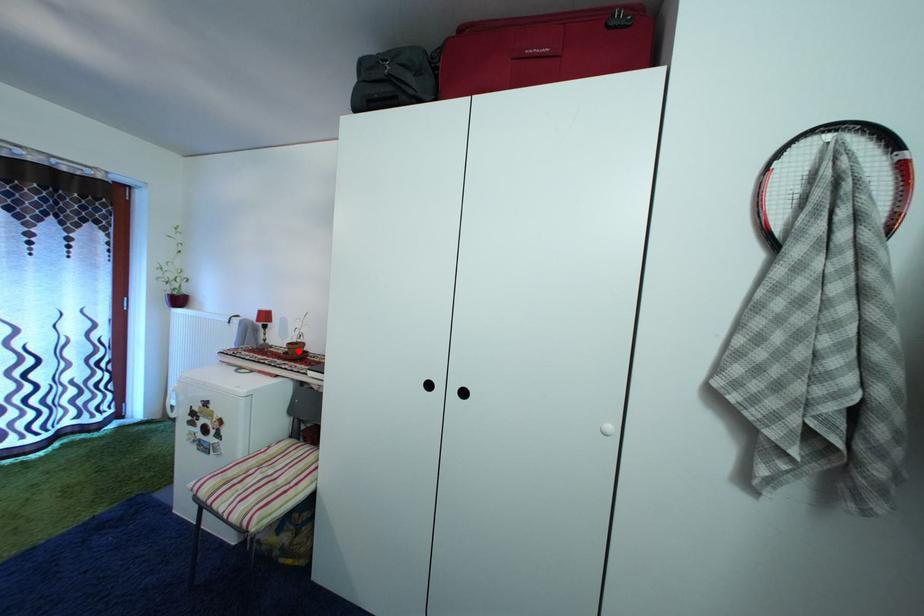
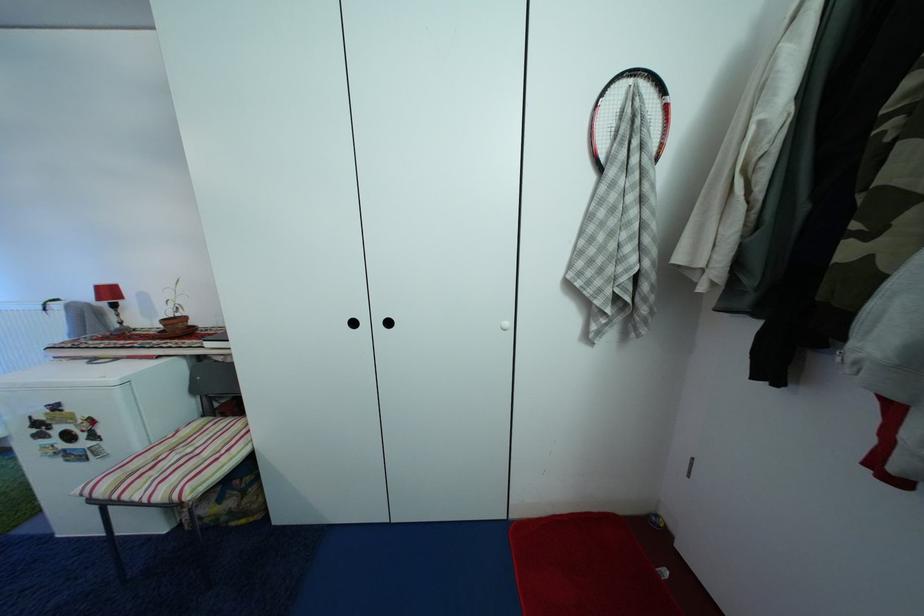
Question: I am providing you with two images of the same scene from different viewpoints. A red point is shown in image1. For the corresponding object point in image2, is it positioned nearer or farther from the camera?

Choices:
 (A) Nearer
 (B) Farther

Answer: (A)